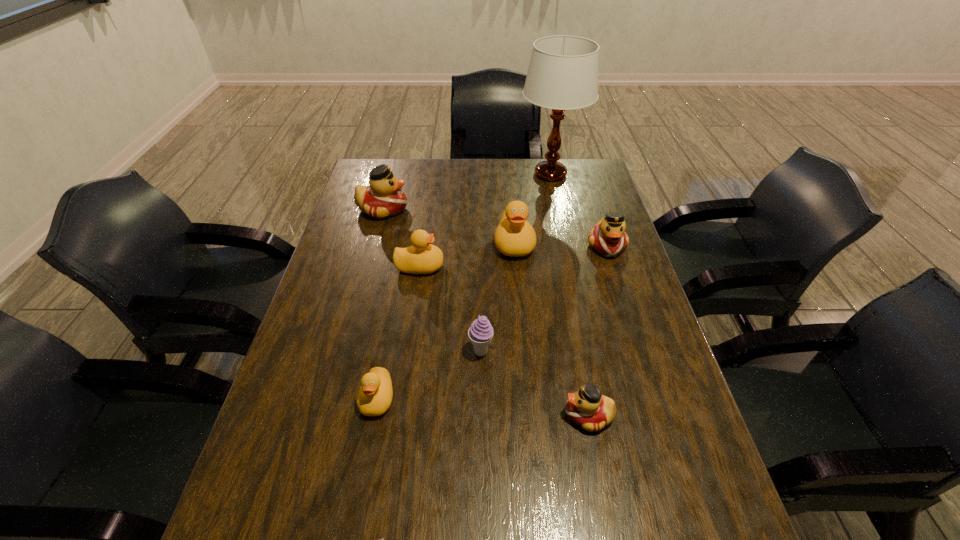
This screenshot has width=960, height=540. In order to click on blank space located on the face of the fifth duck from left to right in this screenshot , I will do `click(495, 415)`.

Locate an element on the screen. This screenshot has width=960, height=540. free space located 0.390m on the face of the fifth duck from left to right is located at coordinates (386, 415).

I want to click on free space located on the face of the fifth duck from left to right, so click(x=532, y=415).

Image resolution: width=960 pixels, height=540 pixels. Identify the location of free location located on the face of the smallest yellow duck. (353, 526).

This screenshot has width=960, height=540. I want to click on object that is at the far edge, so click(x=563, y=71).

The width and height of the screenshot is (960, 540). In order to click on object located at the left edge in this screenshot , I will do `click(384, 198)`.

Locate an element on the screen. This screenshot has height=540, width=960. table lamp that is at the right edge is located at coordinates (563, 71).

At what (x,y) coordinates should I click in order to perform the action: click on duck at the right edge. Please return your answer as a coordinate pair (x, y). Image resolution: width=960 pixels, height=540 pixels. Looking at the image, I should click on (608, 237).

Locate an element on the screen. object that is positioned at the far right corner is located at coordinates (563, 71).

Find the location of `vacant point at the far edge`. vacant point at the far edge is located at coordinates (468, 167).